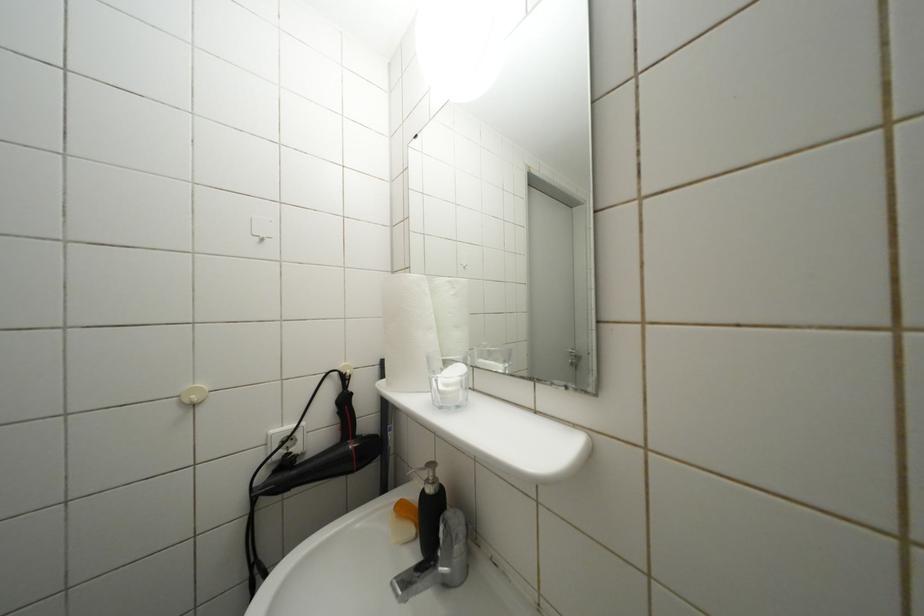
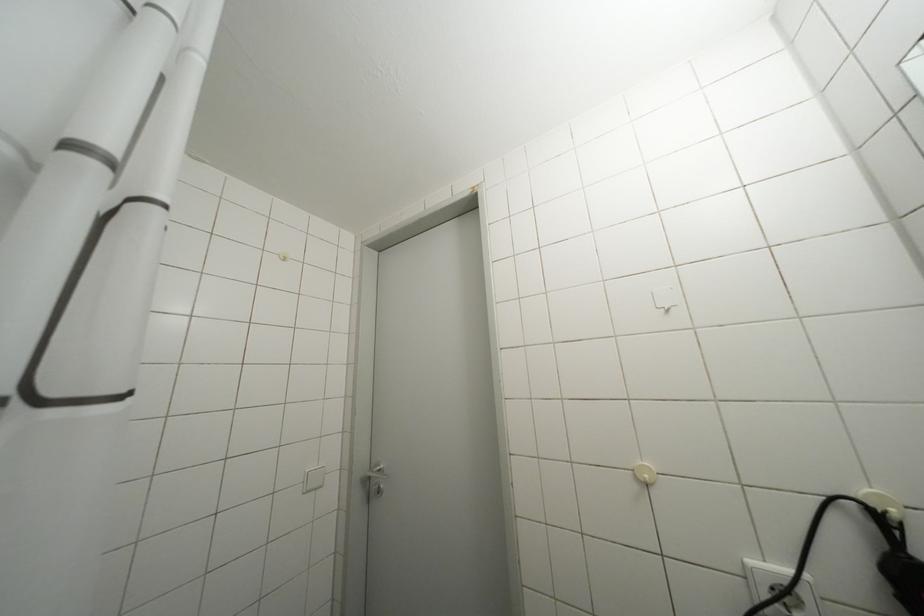
Question: The camera is either moving clockwise (left) or counter-clockwise (right) around the object. The first image is from the beginning of the video and the second image is from the end. Is the camera moving left or right when shooting the video?

Choices:
 (A) Left
 (B) Right

Answer: (B)